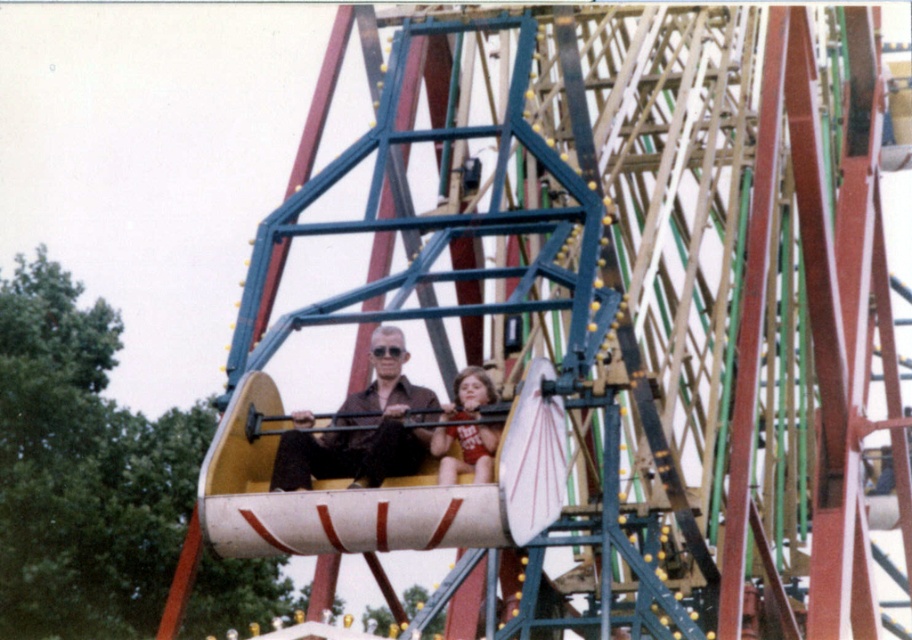
Question: Which object is closer to the camera taking this photo?

Choices:
 (A) matte red swimsuit at center
 (B) matte brown shirt at center

Answer: (A)

Question: Does matte brown shirt at center appear over matte red swimsuit at center?

Choices:
 (A) no
 (B) yes

Answer: (B)

Question: Can you confirm if matte brown shirt at center is bigger than matte red swimsuit at center?

Choices:
 (A) no
 (B) yes

Answer: (B)

Question: In this image, where is matte brown shirt at center located relative to matte red swimsuit at center?

Choices:
 (A) below
 (B) above

Answer: (B)

Question: Which of the following is the farthest from the observer?

Choices:
 (A) matte red swimsuit at center
 (B) matte brown shirt at center

Answer: (B)